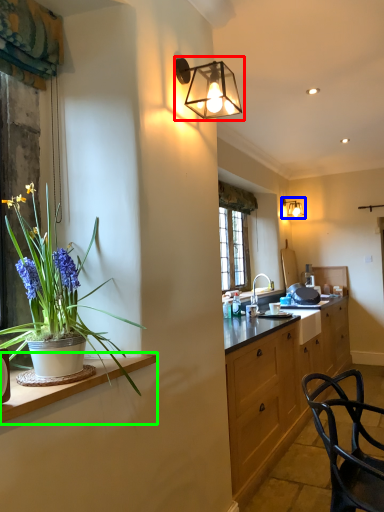
Question: Which is nearer to the lamp (highlighted by a red box)? lamp (highlighted by a blue box) or countertop (highlighted by a green box).

Choices:
 (A) lamp
 (B) countertop

Answer: (B)